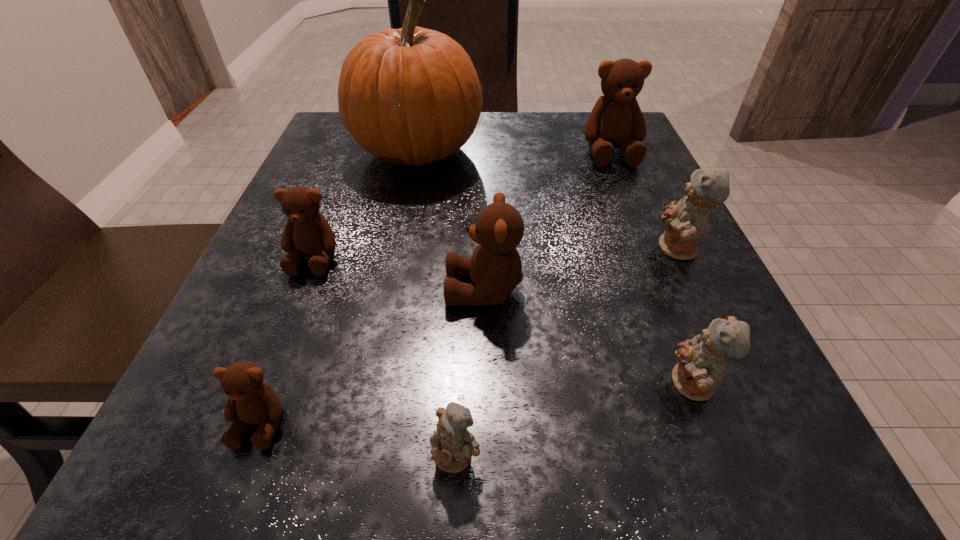
Locate an element on the screen. This screenshot has height=540, width=960. object that is at the far right corner is located at coordinates (616, 121).

In the image, there is a desktop. At what (x,y) coordinates should I click in order to perform the action: click on vacant area at the far edge. Please return your answer as a coordinate pair (x, y). The image size is (960, 540). Looking at the image, I should click on (537, 115).

The height and width of the screenshot is (540, 960). Identify the location of blank space at the near edge. (630, 467).

Locate an element on the screen. Image resolution: width=960 pixels, height=540 pixels. free space at the left edge of the desktop is located at coordinates (358, 209).

What are the coordinates of `vacant region at the right edge of the desktop` in the screenshot? It's located at (640, 220).

Locate an element on the screen. The image size is (960, 540). vacant space at the far left corner of the desktop is located at coordinates (353, 158).

Locate an element on the screen. This screenshot has height=540, width=960. vacant position at the far right corner of the desktop is located at coordinates (567, 133).

Where is `empty space between the pumpkin and the rightmost blue teddy bear`? empty space between the pumpkin and the rightmost blue teddy bear is located at coordinates (548, 200).

You are a GUI agent. You are given a task and a screenshot of the screen. Output one action in this format:
    pyautogui.click(x=<x>, y=<y>)
    Task: Click on the free point between the farthest blue teddy bear and the orange pumpkin
    The width and height of the screenshot is (960, 540).
    Given the screenshot: What is the action you would take?
    pyautogui.click(x=548, y=200)

Locate an element on the screen. The width and height of the screenshot is (960, 540). vacant area that lies between the third brown teddy bear from left to right and the seventh shortest object is located at coordinates (547, 221).